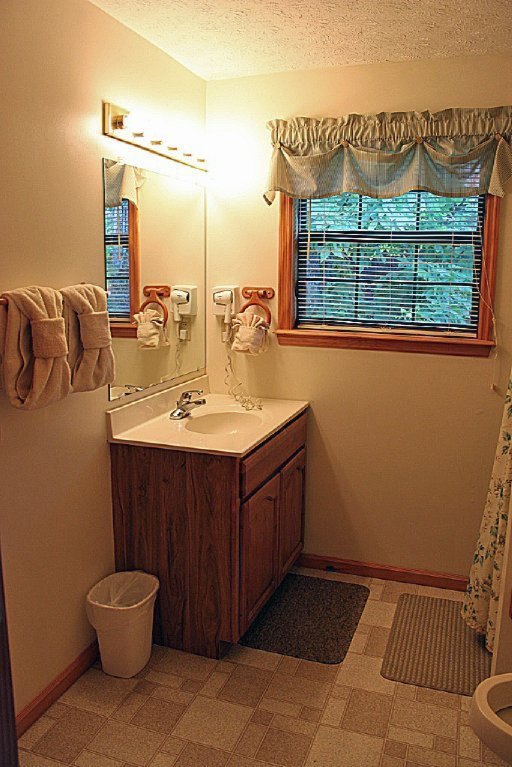
What are the coordinates of `mirror` in the screenshot? It's located at (148, 294).